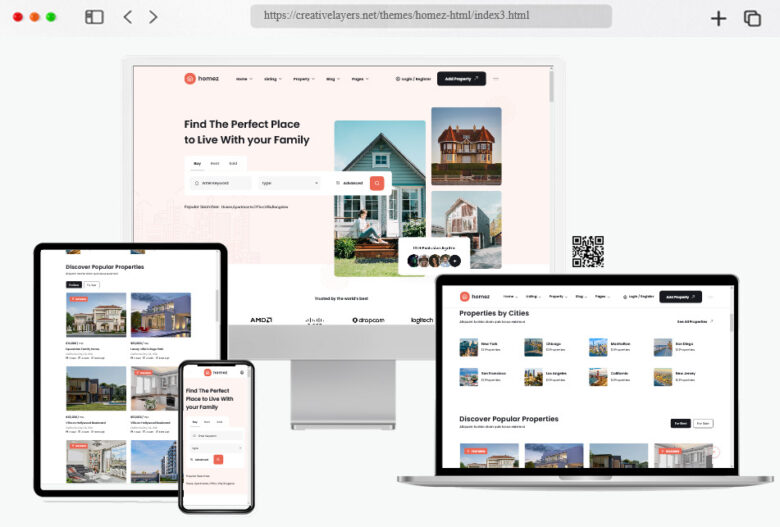
Locate an element on the screen. laptop is located at coordinates (417, 479), (360, 399).